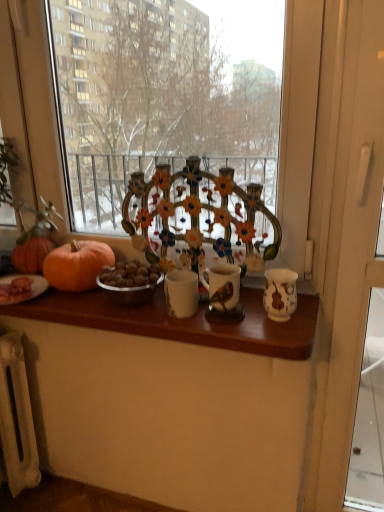
Question: From the image's perspective, is wooden table at center below white plastic screen door at right?

Choices:
 (A) no
 (B) yes

Answer: (A)

Question: Is wooden table at center not inside white plastic screen door at right?

Choices:
 (A) yes
 (B) no

Answer: (A)

Question: Is wooden table at center aimed at white plastic screen door at right?

Choices:
 (A) no
 (B) yes

Answer: (A)

Question: Is white plastic screen door at right completely or partially inside wooden table at center?

Choices:
 (A) no
 (B) yes

Answer: (A)

Question: Can you confirm if wooden table at center is smaller than white plastic screen door at right?

Choices:
 (A) no
 (B) yes

Answer: (B)

Question: Considering the relative sizes of wooden table at center and white plastic screen door at right in the image provided, is wooden table at center bigger than white plastic screen door at right?

Choices:
 (A) yes
 (B) no

Answer: (B)

Question: Is orange matte pumpkin at left smaller than white plastic screen door at right?

Choices:
 (A) yes
 (B) no

Answer: (A)

Question: Could you tell me if orange matte pumpkin at left is facing white plastic screen door at right?

Choices:
 (A) no
 (B) yes

Answer: (A)

Question: Is orange matte pumpkin at left taller than white plastic screen door at right?

Choices:
 (A) no
 (B) yes

Answer: (A)

Question: Considering the relative positions of orange matte pumpkin at left and white plastic screen door at right in the image provided, is orange matte pumpkin at left to the left of white plastic screen door at right from the viewer's perspective?

Choices:
 (A) yes
 (B) no

Answer: (A)

Question: Is the surface of orange matte pumpkin at left in direct contact with white plastic screen door at right?

Choices:
 (A) yes
 (B) no

Answer: (B)

Question: Considering the relative positions of orange matte pumpkin at left and white plastic screen door at right in the image provided, is orange matte pumpkin at left behind white plastic screen door at right?

Choices:
 (A) no
 (B) yes

Answer: (B)

Question: From the image's perspective, would you say wooden table at center is positioned over orange matte pumpkin at left?

Choices:
 (A) no
 (B) yes

Answer: (A)